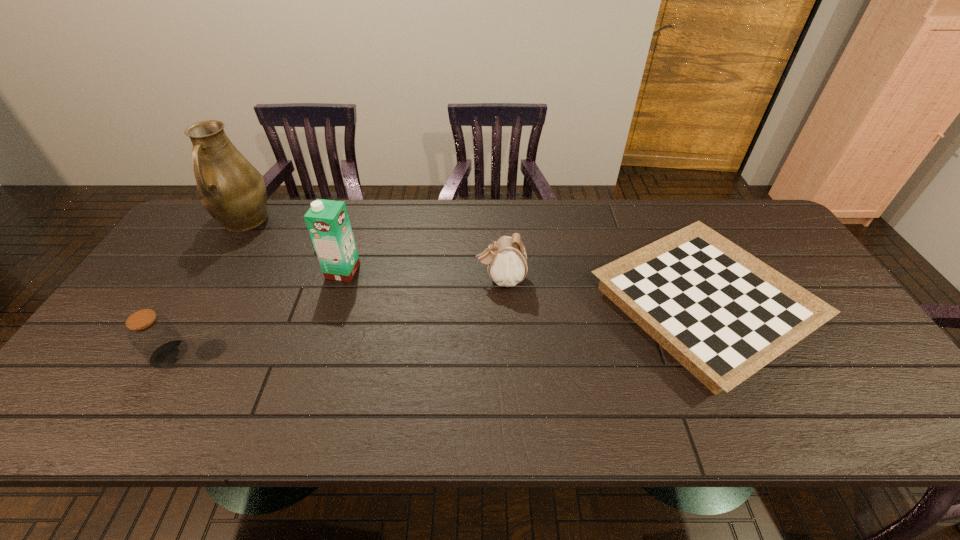
Where is `free point that satisfies the following two spatial constraints: 1. on the front-facing side of the pouch; 2. on the back side of the shortest object`? free point that satisfies the following two spatial constraints: 1. on the front-facing side of the pouch; 2. on the back side of the shortest object is located at coordinates (502, 306).

Identify the location of free space that satisfies the following two spatial constraints: 1. on the handle side of the jar; 2. on the left side of the pitcher. This screenshot has width=960, height=540. (161, 354).

This screenshot has width=960, height=540. Identify the location of vacant space that satisfies the following two spatial constraints: 1. on the front-facing side of the shortest object; 2. on the left side of the pouch. (502, 306).

Locate an element on the screen. This screenshot has height=540, width=960. free point that satisfies the following two spatial constraints: 1. on the handle side of the third object from right to left; 2. on the right side of the tallest object is located at coordinates (212, 271).

I want to click on free region that satisfies the following two spatial constraints: 1. on the handle side of the tallest object; 2. on the left side of the jar, so click(x=161, y=354).